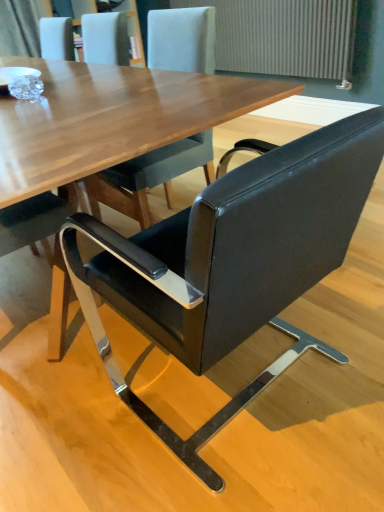
Describe the element at coordinates (284, 37) in the screenshot. I see `gray textured radiator at upper right` at that location.

Identify the location of gray textured radiator at upper right. The image size is (384, 512). (284, 37).

Describe the element at coordinates (231, 262) in the screenshot. I see `black leather chair at center` at that location.

At what (x,y) coordinates should I click in order to perform the action: click on black leather chair at center. Please return your answer as a coordinate pair (x, y). This screenshot has width=384, height=512. Looking at the image, I should click on (231, 262).

Locate an element on the screen. The width and height of the screenshot is (384, 512). gray textured radiator at upper right is located at coordinates (284, 37).

Can you confirm if black leather chair at center is positioned to the left of gray textured radiator at upper right?

Yes, black leather chair at center is to the left of gray textured radiator at upper right.

Relative to gray textured radiator at upper right, is black leather chair at center in front or behind?

In the image, black leather chair at center appears in front of gray textured radiator at upper right.

Does point (193, 242) appear closer or farther from the camera than point (275, 56)?

Point (193, 242).

From the image's perspective, between black leather chair at center and gray textured radiator at upper right, who is located below?

black leather chair at center is shown below in the image.

From a real-world perspective, is black leather chair at center under gray textured radiator at upper right?

Correct, in the physical world, black leather chair at center is lower than gray textured radiator at upper right.

From the picture: Does black leather chair at center have a greater width compared to gray textured radiator at upper right?

Indeed, black leather chair at center has a greater width compared to gray textured radiator at upper right.

Based on the photo, considering the sizes of objects black leather chair at center and gray textured radiator at upper right in the image provided, who is taller, black leather chair at center or gray textured radiator at upper right?

Standing taller between the two is gray textured radiator at upper right.

Does black leather chair at center have a smaller size compared to gray textured radiator at upper right?

Actually, black leather chair at center might be larger than gray textured radiator at upper right.

Can gray textured radiator at upper right be found inside black leather chair at center?

No, gray textured radiator at upper right is located outside of black leather chair at center.

Is black leather chair at center in contact with gray textured radiator at upper right?

black leather chair at center and gray textured radiator at upper right are not in contact.

Is black leather chair at center oriented towards gray textured radiator at upper right?

No, black leather chair at center is not turned towards gray textured radiator at upper right.

What's the angular difference between black leather chair at center and gray textured radiator at upper right's facing directions?

90.1 degrees.

Where is `chair on the left of gray textured radiator at upper right`? chair on the left of gray textured radiator at upper right is located at coordinates (231, 262).

Considering the positions of objects gray textured radiator at upper right and black leather chair at center in the image provided, who is more to the right, gray textured radiator at upper right or black leather chair at center?

From the viewer's perspective, gray textured radiator at upper right appears more on the right side.

Is gray textured radiator at upper right positioned in front of black leather chair at center?

No, it is behind black leather chair at center.

Is point (339, 30) in front of point (206, 252)?

No, (339, 30) is further to viewer.

From the image's perspective, is gray textured radiator at upper right under black leather chair at center?

No, from the image's perspective, gray textured radiator at upper right is not below black leather chair at center.

From a real-world perspective, is gray textured radiator at upper right physically below black leather chair at center?

No, from a real-world perspective, gray textured radiator at upper right is not under black leather chair at center.

Considering the sizes of gray textured radiator at upper right and black leather chair at center in the image, is gray textured radiator at upper right wider or thinner than black leather chair at center?

Clearly, gray textured radiator at upper right has less width compared to black leather chair at center.

Who is taller, gray textured radiator at upper right or black leather chair at center?

gray textured radiator at upper right.

Based on their sizes in the image, would you say gray textured radiator at upper right is bigger or smaller than black leather chair at center?

In the image, gray textured radiator at upper right appears to be smaller than black leather chair at center.

Do you think gray textured radiator at upper right is within black leather chair at center, or outside of it?

gray textured radiator at upper right is located beyond the bounds of black leather chair at center.

Is gray textured radiator at upper right far away from black leather chair at center?

Indeed, gray textured radiator at upper right is not near black leather chair at center.

Is gray textured radiator at upper right oriented towards black leather chair at center?

No, gray textured radiator at upper right is not oriented towards black leather chair at center.

Consider the image. How many degrees apart are the facing directions of gray textured radiator at upper right and black leather chair at center?

The angular difference between gray textured radiator at upper right and black leather chair at center is 90.1 degrees.

Identify the location of radiator to the right of black leather chair at center. The width and height of the screenshot is (384, 512). (284, 37).

Find the location of `radiator positioned vertically above the black leather chair at center (from a real-world perspective)`. radiator positioned vertically above the black leather chair at center (from a real-world perspective) is located at coordinates (284, 37).

At what (x,y) coordinates should I click in order to perform the action: click on chair below the gray textured radiator at upper right (from the image's perspective). Please return your answer as a coordinate pair (x, y). The width and height of the screenshot is (384, 512). Looking at the image, I should click on (231, 262).